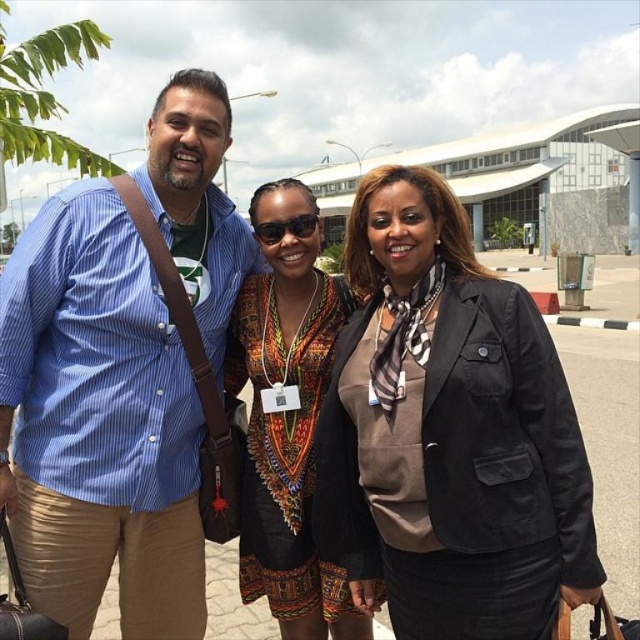
Who is higher up, black matte blazer at center or printed fabric dress at center?

black matte blazer at center is above.

Can you confirm if black matte blazer at center is positioned above printed fabric dress at center?

Indeed, black matte blazer at center is positioned over printed fabric dress at center.

Does point (554, 461) come in front of point (269, 356)?

Yes.

The image size is (640, 640). In order to click on black matte blazer at center in this screenshot , I will do `click(449, 433)`.

Who is more forward, (461, 320) or (134, 433)?

Point (461, 320)

Consider the image. Can you confirm if black matte blazer at center is wider than blue striped shirt at left?

Yes, black matte blazer at center is wider than blue striped shirt at left.

Find the location of a particular element. black matte blazer at center is located at coordinates [449, 433].

Is blue striped shirt at left positioned in front of printed fabric dress at center?

That is True.

Is blue striped shirt at left taller than printed fabric dress at center?

In fact, blue striped shirt at left may be shorter than printed fabric dress at center.

You are a GUI agent. You are given a task and a screenshot of the screen. Output one action in this format:
    pyautogui.click(x=<x>, y=<y>)
    Task: Click on the blue striped shirt at left
    The image size is (640, 640).
    Given the screenshot: What is the action you would take?
    pyautogui.click(x=99, y=422)